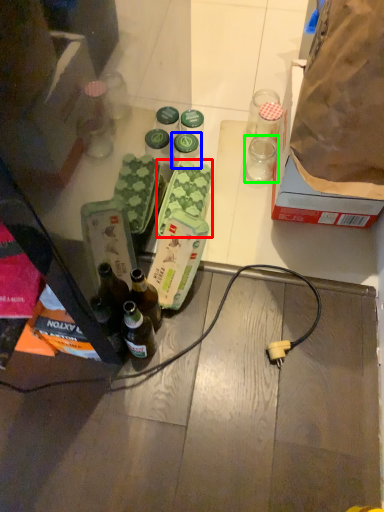
Question: Which object is positioned closest to food (highlighted by a red box)? Select from bottle (highlighted by a blue box) and coffee cup (highlighted by a green box).

Choices:
 (A) bottle
 (B) coffee cup

Answer: (A)